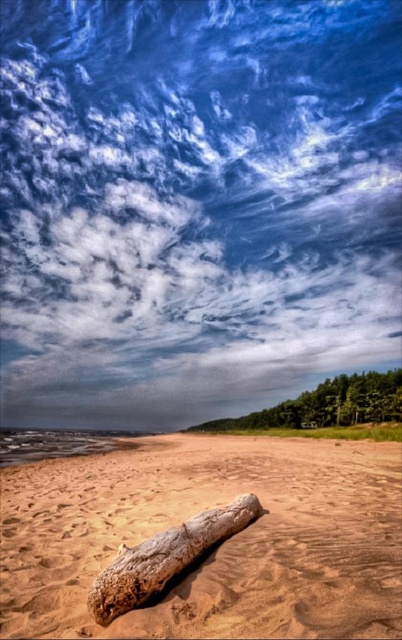
Between brown sandy beach at lower center and brown textured log at center, which one appears on the left side from the viewer's perspective?

brown textured log at center is more to the left.

Looking at this image, does brown sandy beach at lower center have a smaller size compared to brown textured log at center?

Incorrect, brown sandy beach at lower center is not smaller in size than brown textured log at center.

I want to click on brown sandy beach at lower center, so click(217, 548).

Locate an element on the screen. This screenshot has height=640, width=402. brown sandy beach at lower center is located at coordinates (217, 548).

Which is below, white fluffy cloud at upper center or brown sandy beach at lower center?

brown sandy beach at lower center is lower down.

Is point (67, 109) positioned in front of point (360, 536)?

No.

Find the location of a particular element. This screenshot has height=640, width=402. white fluffy cloud at upper center is located at coordinates (194, 204).

Which is in front, point (49, 284) or point (104, 605)?

Positioned in front is point (104, 605).

Is point (116, 214) closer to camera compared to point (252, 518)?

That is False.

Where is `white fluffy cloud at upper center`? The image size is (402, 640). white fluffy cloud at upper center is located at coordinates (194, 204).

What are the coordinates of `white fluffy cloud at upper center` in the screenshot? It's located at (194, 204).